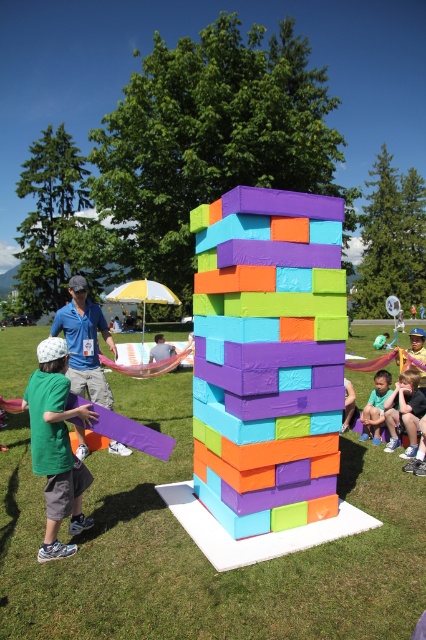
From the picture: You are a photographer standing in the park and want to capture a photo of the matte blue shirt at center and the light blue fabric at center. Which object will appear larger in the photo?

The matte blue shirt at center will appear larger in the photo because it is closer to the viewer than the light blue fabric at center.

You are a visitor observing the scene. You notice the matte plastic blocks at center and the matte blue shorts at lower right. Which object is positioned higher in the image?

The matte plastic blocks at center are positioned higher than the matte blue shorts at lower right.